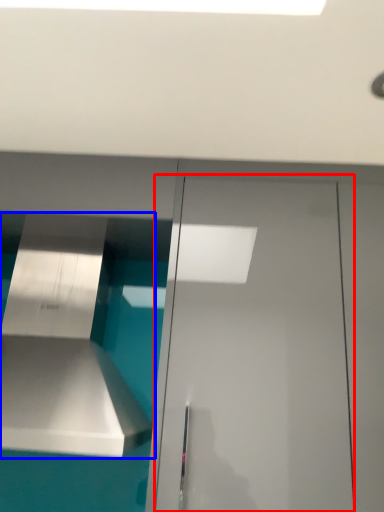
Question: Among these objects, which one is farthest to the camera, door (highlighted by a red box) or vent (highlighted by a blue box)?

Choices:
 (A) door
 (B) vent

Answer: (A)